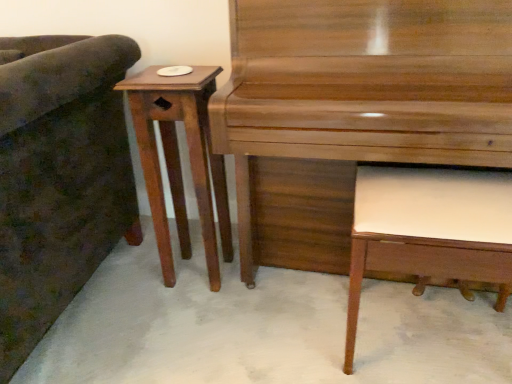
Question: Should I look upward or downward to see shiny brown piano at center?

Choices:
 (A) up
 (B) down

Answer: (A)

Question: Does dark green fabric couch at left have a lesser height compared to mahogany wood side table at left?

Choices:
 (A) yes
 (B) no

Answer: (B)

Question: From the image's perspective, is dark green fabric couch at left on mahogany wood side table at left?

Choices:
 (A) no
 (B) yes

Answer: (A)

Question: Is dark green fabric couch at left at the right side of mahogany wood side table at left?

Choices:
 (A) yes
 (B) no

Answer: (B)

Question: Is the depth of dark green fabric couch at left greater than that of mahogany wood side table at left?

Choices:
 (A) no
 (B) yes

Answer: (A)

Question: Is mahogany wood side table at left at the back of dark green fabric couch at left?

Choices:
 (A) yes
 (B) no

Answer: (B)

Question: Is mahogany wood side table at left completely or partially inside dark green fabric couch at left?

Choices:
 (A) no
 (B) yes

Answer: (A)

Question: Is white leather music stool at lower right located within mahogany wood side table at left?

Choices:
 (A) no
 (B) yes

Answer: (A)

Question: Would you consider mahogany wood side table at left to be distant from white leather music stool at lower right?

Choices:
 (A) no
 (B) yes

Answer: (A)

Question: Considering the relative sizes of mahogany wood side table at left and white leather music stool at lower right in the image provided, is mahogany wood side table at left wider than white leather music stool at lower right?

Choices:
 (A) yes
 (B) no

Answer: (B)

Question: Would you say mahogany wood side table at left is outside white leather music stool at lower right?

Choices:
 (A) yes
 (B) no

Answer: (A)

Question: Considering the relative sizes of mahogany wood side table at left and white leather music stool at lower right in the image provided, is mahogany wood side table at left bigger than white leather music stool at lower right?

Choices:
 (A) yes
 (B) no

Answer: (B)

Question: Is mahogany wood side table at left touching white leather music stool at lower right?

Choices:
 (A) no
 (B) yes

Answer: (A)

Question: Is white leather music stool at lower right not within mahogany wood side table at left?

Choices:
 (A) yes
 (B) no

Answer: (A)